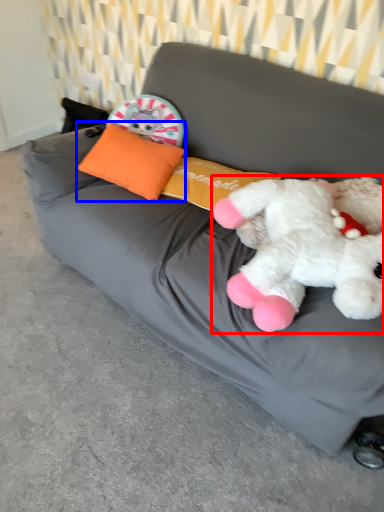
Question: Which object appears farthest to the camera in this image, toy (highlighted by a red box) or pillow (highlighted by a blue box)?

Choices:
 (A) toy
 (B) pillow

Answer: (B)